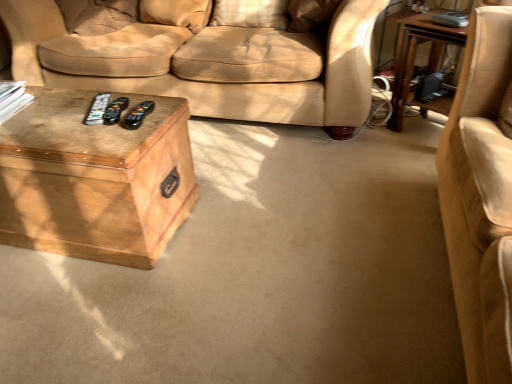
The width and height of the screenshot is (512, 384). Find the location of `vacant region to the left of black plastic remote at center, marked as the 3th remote in a right-to-left arrangement`. vacant region to the left of black plastic remote at center, marked as the 3th remote in a right-to-left arrangement is located at coordinates (60, 110).